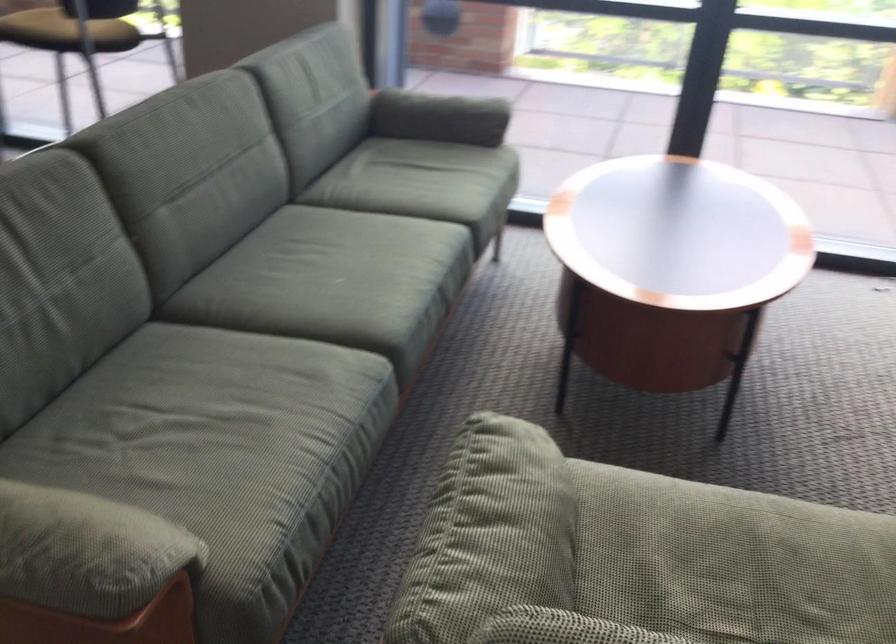
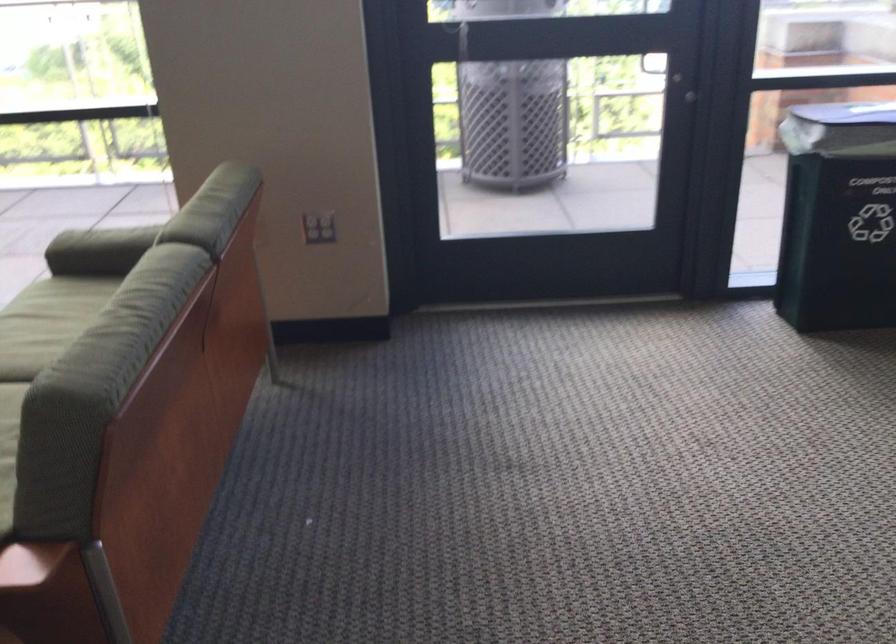
Question: What movement of the cameraman would produce the second image?

Choices:
 (A) Left
 (B) Right
 (C) Forward
 (D) Backward

Answer: (B)